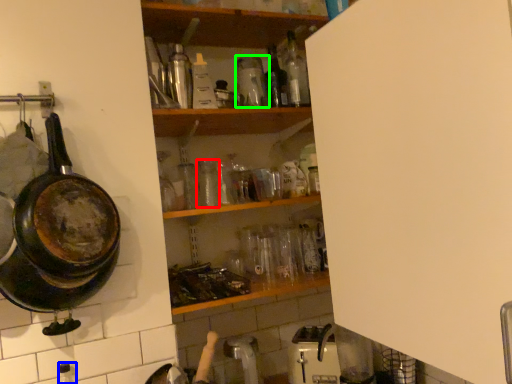
Question: Considering the real-world distances, which object is closest to bottle (highlighted by a red box)? bottle (highlighted by a blue box) or bottle (highlighted by a green box).

Choices:
 (A) bottle
 (B) bottle

Answer: (B)